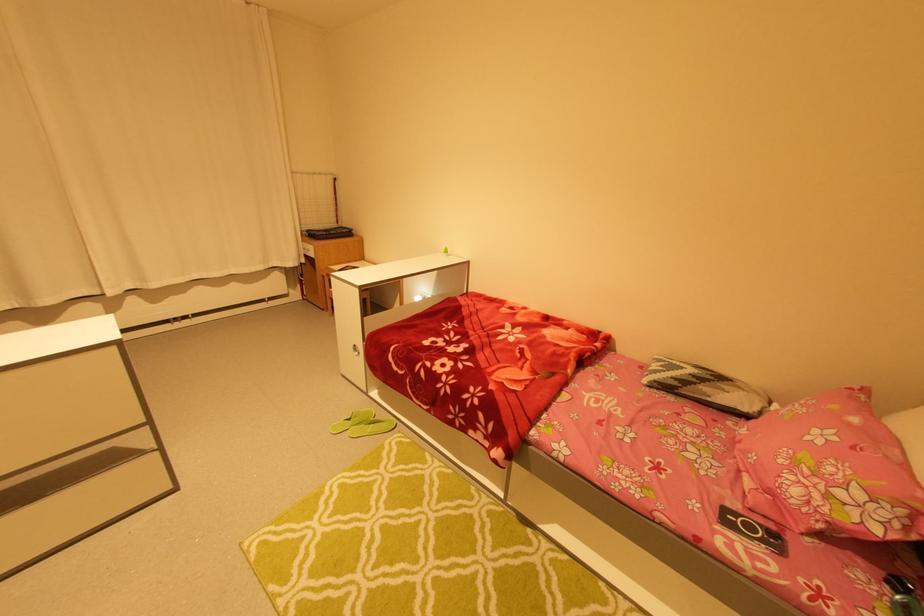
What do you see at coordinates (356, 350) in the screenshot?
I see `the silver cabinet knob` at bounding box center [356, 350].